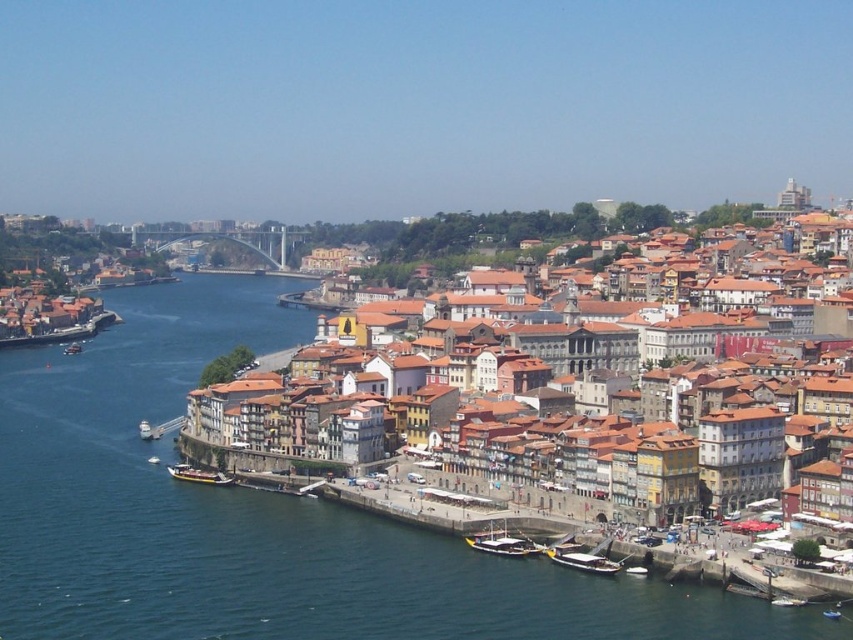
Is wooden polished boat at lower center further to the viewer compared to metallic silver boat at lower right?

That is True.

From the picture: Measure the distance between point [479,544] and camera.

159.20 meters

Find the location of a particular element. wooden polished boat at lower center is located at coordinates (502, 544).

Is white glossy boat at lower left thinner than wooden boat at lower left?

Correct, white glossy boat at lower left's width is less than wooden boat at lower left's.

Where is `white glossy boat at lower left`? white glossy boat at lower left is located at coordinates (144, 429).

Locate an element on the screen. This screenshot has width=853, height=640. white glossy boat at lower left is located at coordinates (144, 429).

Can you confirm if brown textured buildings at center is positioned to the left of wooden polished boat at lower left?

In fact, brown textured buildings at center is to the right of wooden polished boat at lower left.

Is brown textured buildings at center smaller than wooden polished boat at lower left?

No, brown textured buildings at center is not smaller than wooden polished boat at lower left.

This screenshot has height=640, width=853. What do you see at coordinates (677, 428) in the screenshot?
I see `brown textured buildings at center` at bounding box center [677, 428].

Find the location of `brown textured buildings at center`. brown textured buildings at center is located at coordinates (677, 428).